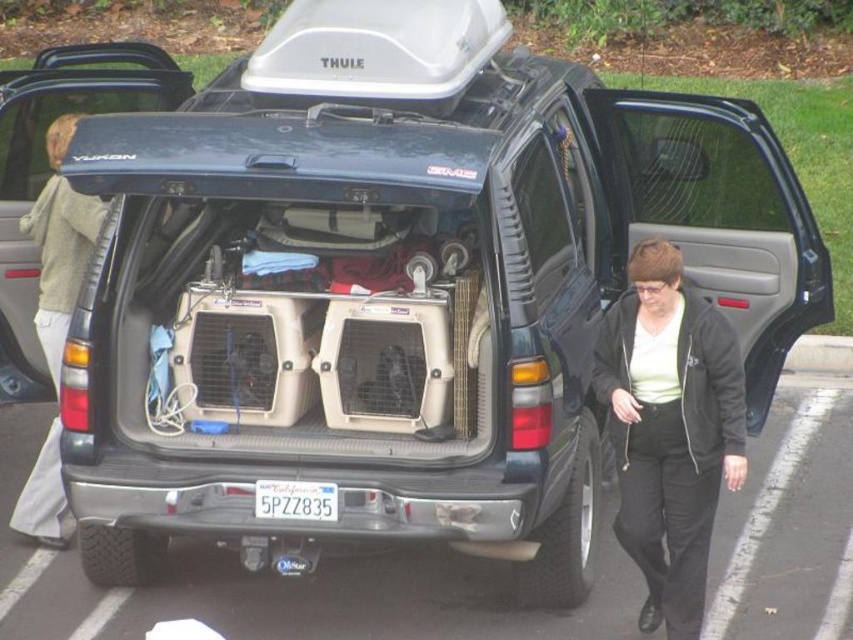
You are standing at the camera position and want to walk towards the point marked at coordinates point [605,561]. How far will you have to walk to reach that point?

You will have to walk 7.70 meters to reach the point marked at coordinates point [605,561].

You are a delivery drone operator. Your drone needs to land on the black rubber parking lot at lower center but must avoid the white plastic license plate at center. Is the parking lot surface accessible for landing without hitting the license plate?

The black rubber parking lot at lower center is further to the viewer than the white plastic license plate at center, meaning the license plate is closer to the drone. Therefore, the drone can safely land on the parking lot surface without hitting the license plate since the plate is positioned in front of it.

You are standing in a parking lot and see a dark GMC Yukon SUV with its tailgate open. Inside the cargo area, there are two beige pet carriers. You also notice a black matte jacket at lower right. If you want to reach the jacket without moving the carriers, is it possible?

The black matte jacket at lower right is 6.12 meters away from viewer, so it is too far to reach without moving the carriers.